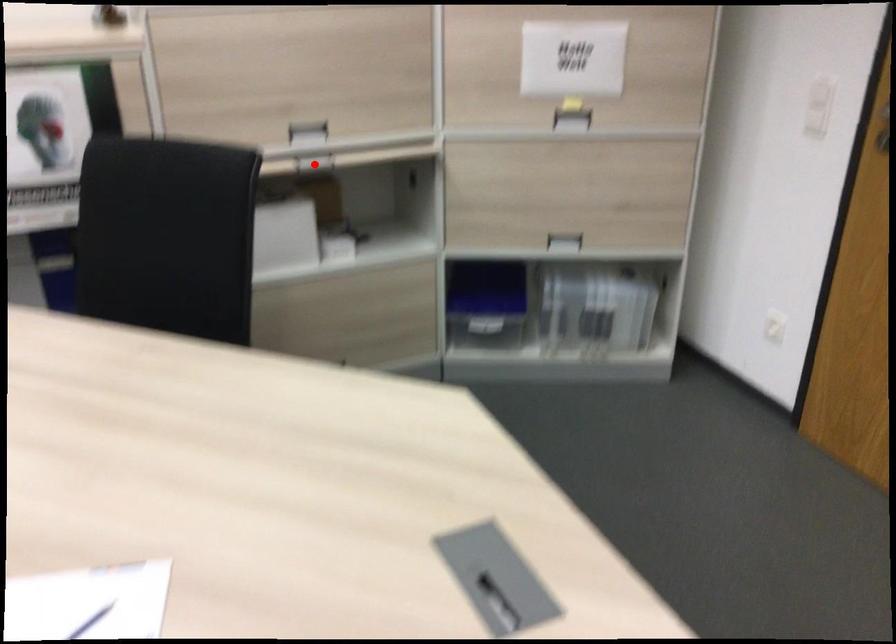
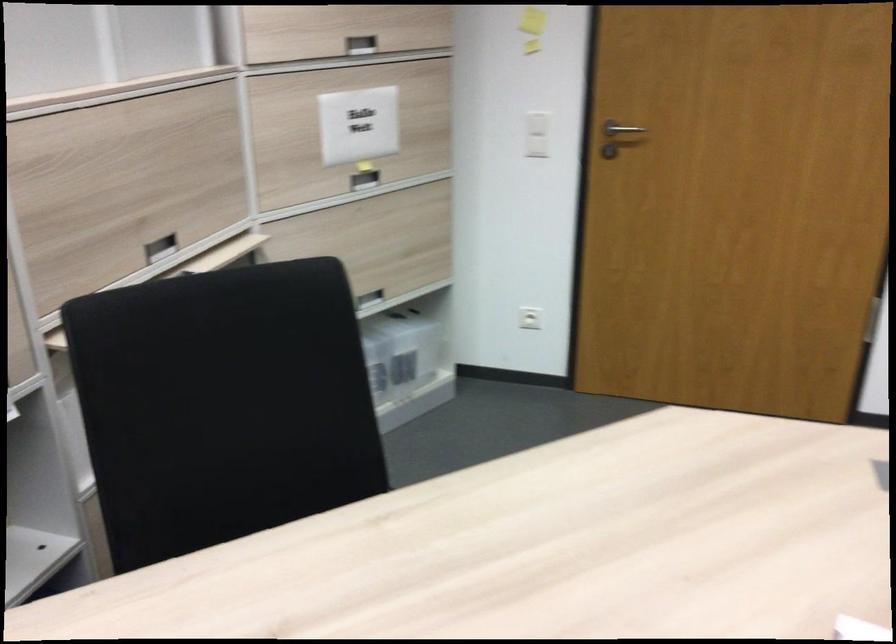
Question: I am providing you with two images of the same scene from different viewpoints. A red point is marked on the first image. Can you still see the location of the red point in image 2?

Choices:
 (A) Yes
 (B) No

Answer: (B)